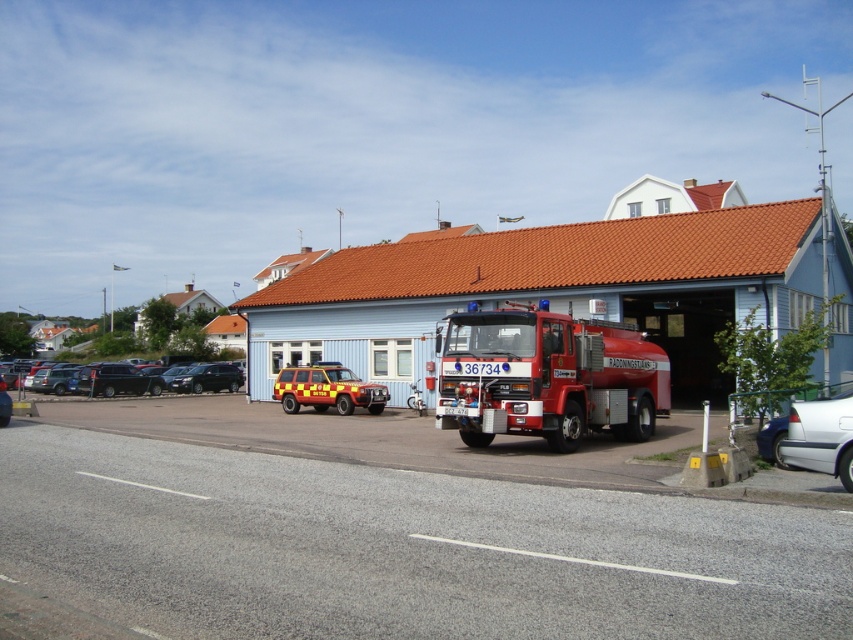
Question: Is matte black suv at center-left above silver metallic sedan at lower right?

Choices:
 (A) yes
 (B) no

Answer: (B)

Question: Is silver metallic sedan at lower right further to the viewer compared to yellow matte suv at center?

Choices:
 (A) no
 (B) yes

Answer: (A)

Question: Which point is farther to the camera?

Choices:
 (A) shiny red fire truck at center
 (B) yellow matte suv at center
 (C) silver metallic sedan at lower right
 (D) matte black suv at center-left

Answer: (D)

Question: Which object is farther from the camera taking this photo?

Choices:
 (A) matte black suv at center-left
 (B) yellow matte suv at center

Answer: (A)

Question: Does matte black suv at center-left come behind yellow matte suv at center?

Choices:
 (A) no
 (B) yes

Answer: (B)

Question: Among these objects, which one is nearest to the camera?

Choices:
 (A) silver metallic sedan at lower right
 (B) matte black suv at center-left
 (C) shiny red fire truck at center
 (D) yellow matte suv at center

Answer: (A)